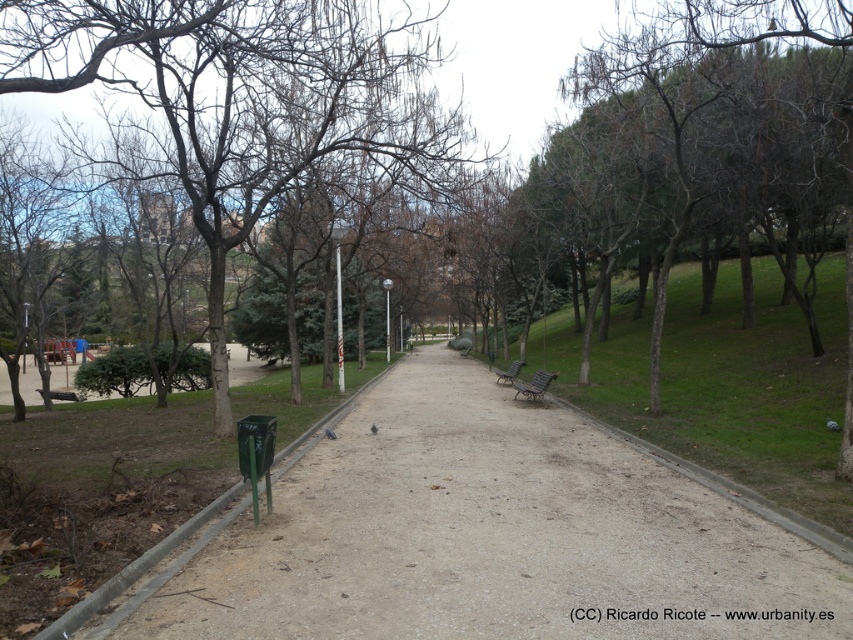
Based on the photo, you are a park visitor who wants to sit on the metallic silver bench at center. However, there is a brown leafless tree at center blocking your view of the path ahead. Can you still see the path clearly from the bench?

The brown leafless tree at center is in front of the metallic silver bench at center, so sitting on the bench would block your view of the path ahead. You won